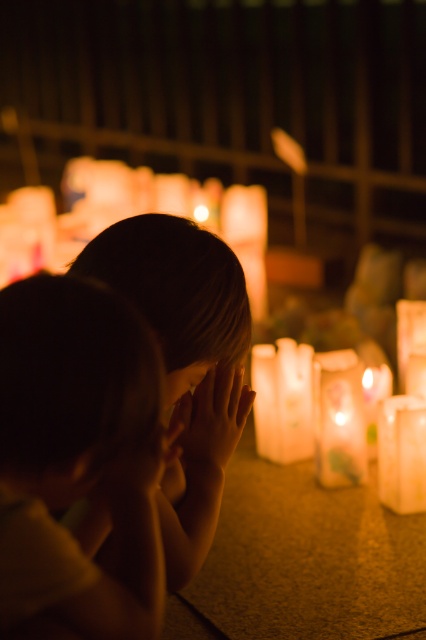
You are standing in the scene and want to place a small flower pot between the two points, point (x=210, y=445) and point (x=207, y=364). Which point should the flower pot be closer to in order to be placed closer to the viewer?

The flower pot should be closer to point (x=210, y=445) because it is further to the viewer than point (x=207, y=364).